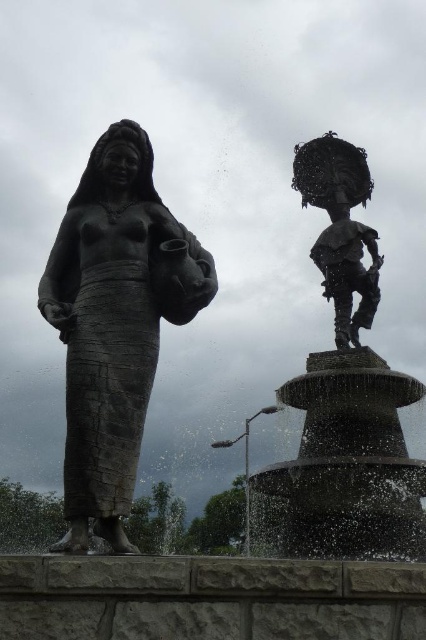
Question: Among these objects, which one is nearest to the camera?

Choices:
 (A) polished bronze statue at upper right
 (B) bronze statue at left

Answer: (B)

Question: Is bronze statue at left further to camera compared to polished bronze statue at upper right?

Choices:
 (A) yes
 (B) no

Answer: (B)

Question: Which point is farther to the camera?

Choices:
 (A) (325, 204)
 (B) (198, 260)

Answer: (A)

Question: Can you confirm if bronze statue at left is positioned to the left of polished bronze statue at upper right?

Choices:
 (A) no
 (B) yes

Answer: (B)

Question: Can you confirm if bronze statue at left is positioned above polished bronze statue at upper right?

Choices:
 (A) yes
 (B) no

Answer: (B)